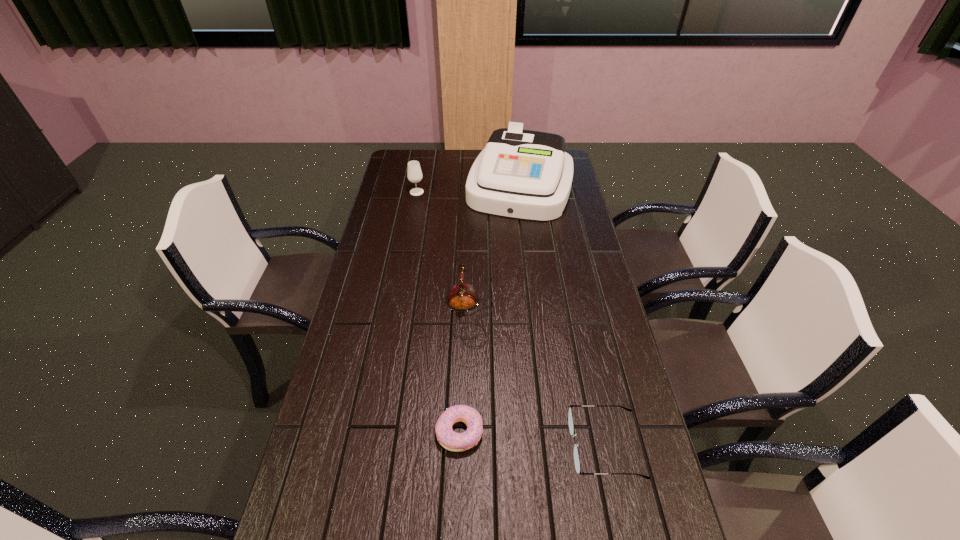
Locate an element on the screen. The height and width of the screenshot is (540, 960). free region located 0.050m on the lenses of the spectacles is located at coordinates (550, 446).

You are a GUI agent. You are given a task and a screenshot of the screen. Output one action in this format:
    pyautogui.click(x=<x>, y=<y>)
    Task: Click on the free point located 0.380m on the lenses of the spectacles
    
    Given the screenshot: What is the action you would take?
    pyautogui.click(x=416, y=446)

I want to click on vacant space located on the lenses of the spectacles, so pos(546,446).

The height and width of the screenshot is (540, 960). I want to click on vacant space located on the left of the shortest object, so click(360, 431).

The width and height of the screenshot is (960, 540). I want to click on object that is at the far edge, so click(522, 174).

Where is `object located in the left edge section of the desktop`? This screenshot has width=960, height=540. object located in the left edge section of the desktop is located at coordinates (414, 173).

Identify the location of cash register located in the right edge section of the desktop. The height and width of the screenshot is (540, 960). (522, 174).

Identify the location of spectacles that is at the right edge. The width and height of the screenshot is (960, 540). (570, 417).

At what (x,y) coordinates should I click in order to perform the action: click on object present at the far right corner. Please return your answer as a coordinate pair (x, y). Looking at the image, I should click on (522, 174).

You are a GUI agent. You are given a task and a screenshot of the screen. Output one action in this format:
    pyautogui.click(x=<x>, y=<y>)
    Task: Click on the vacant area at the left edge of the desktop
    The image size is (960, 540).
    Given the screenshot: What is the action you would take?
    click(403, 191)